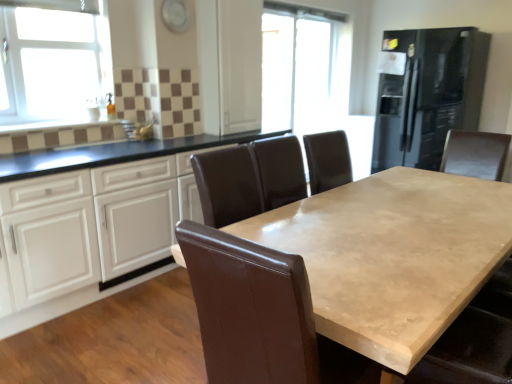
Question: Would you say white glossy cabinets at center is a long distance from brown leather swivel chair at center?

Choices:
 (A) yes
 (B) no

Answer: (A)

Question: Is white glossy cabinets at center smaller than brown leather swivel chair at center?

Choices:
 (A) yes
 (B) no

Answer: (B)

Question: Can we say white glossy cabinets at center lies outside brown leather swivel chair at center?

Choices:
 (A) no
 (B) yes

Answer: (B)

Question: Is white glossy cabinets at center positioned before brown leather swivel chair at center?

Choices:
 (A) no
 (B) yes

Answer: (A)

Question: Can you see white glossy cabinets at center touching brown leather swivel chair at center?

Choices:
 (A) no
 (B) yes

Answer: (A)

Question: From the image's perspective, is white glossy cabinets at center above brown leather swivel chair at center?

Choices:
 (A) no
 (B) yes

Answer: (B)

Question: Is brown leather swivel chair at center taller than white glass window at upper left?

Choices:
 (A) no
 (B) yes

Answer: (B)

Question: Considering the relative positions of brown leather swivel chair at center and white glass window at upper left in the image provided, is brown leather swivel chair at center to the left of white glass window at upper left from the viewer's perspective?

Choices:
 (A) no
 (B) yes

Answer: (A)

Question: Does brown leather swivel chair at center have a lesser width compared to white glass window at upper left?

Choices:
 (A) no
 (B) yes

Answer: (A)

Question: Is brown leather swivel chair at center next to white glass window at upper left and touching it?

Choices:
 (A) yes
 (B) no

Answer: (B)

Question: Is white glass window at upper left a part of brown leather swivel chair at center?

Choices:
 (A) no
 (B) yes

Answer: (A)

Question: Could you tell me if brown leather swivel chair at center is turned towards white glass window at upper left?

Choices:
 (A) yes
 (B) no

Answer: (B)

Question: From the image's perspective, does white glass window at upper left appear higher than black glass refrigerator at right?

Choices:
 (A) no
 (B) yes

Answer: (A)